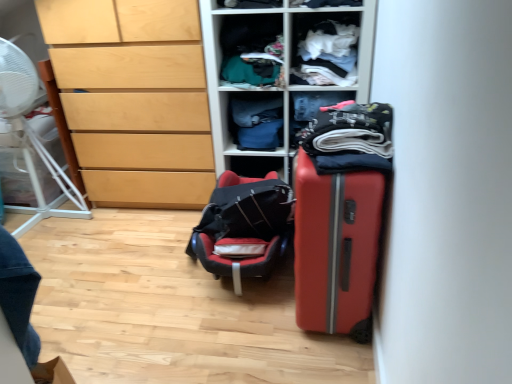
Identify the location of vacant point to the left of matte orange suitcase at right. (247, 328).